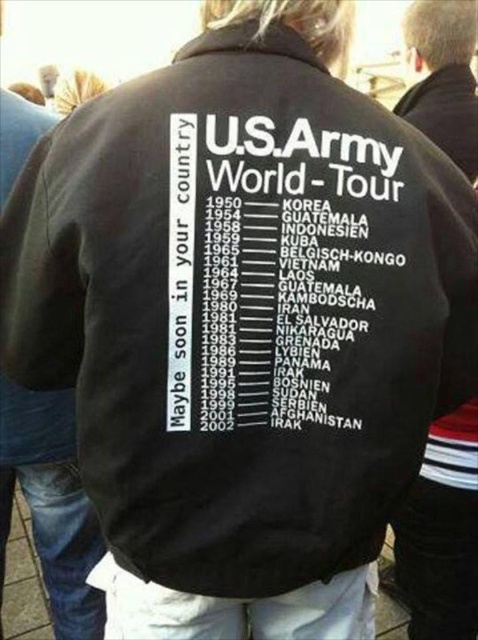
Question: Does black fabric text at center appear on the right side of black fabric jacket at upper center?

Choices:
 (A) yes
 (B) no

Answer: (B)

Question: Among these objects, which one is nearest to the camera?

Choices:
 (A) black fabric jacket at upper center
 (B) black fabric text at center

Answer: (B)

Question: Is black fabric text at center closer to camera compared to black fabric jacket at upper center?

Choices:
 (A) yes
 (B) no

Answer: (A)

Question: Which of the following is the closest to the observer?

Choices:
 (A) black fabric text at center
 (B) black fabric jacket at upper center

Answer: (A)

Question: Does black fabric text at center appear on the left side of black fabric jacket at upper center?

Choices:
 (A) yes
 (B) no

Answer: (A)

Question: Which object appears farthest from the camera in this image?

Choices:
 (A) black fabric text at center
 (B) black fabric jacket at upper center

Answer: (B)